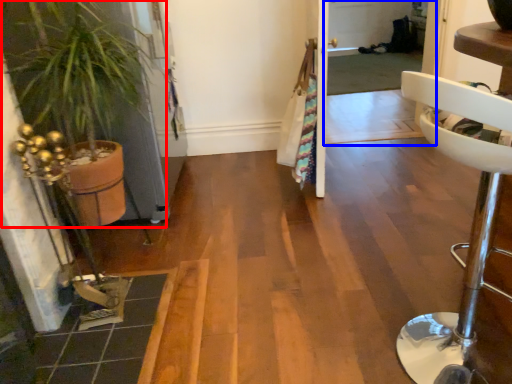
Question: Which object is further to the camera taking this photo, houseplant (highlighted by a red box) or screen door (highlighted by a blue box)?

Choices:
 (A) houseplant
 (B) screen door

Answer: (B)